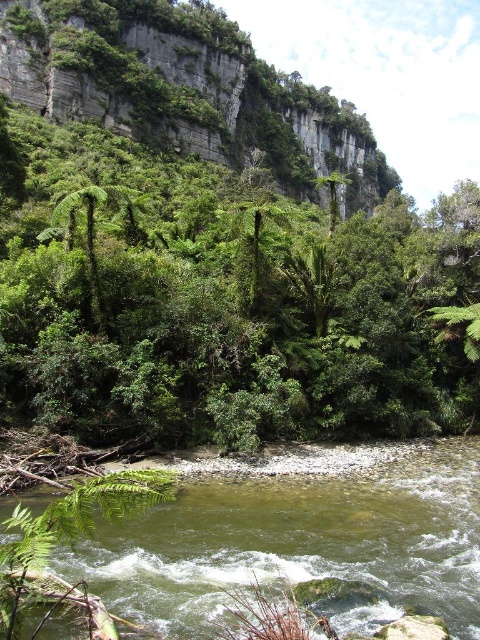
Question: Is green leafy tree at center thinner than green leafy hillside at upper left?

Choices:
 (A) yes
 (B) no

Answer: (A)

Question: Does green leafy tree at center have a greater width compared to green smooth water at center?

Choices:
 (A) no
 (B) yes

Answer: (B)

Question: Is green leafy tree at center thinner than green leafy hillside at upper left?

Choices:
 (A) no
 (B) yes

Answer: (B)

Question: Which of the following is the farthest from the observer?

Choices:
 (A) green leafy tree at center
 (B) green smooth water at center
 (C) green leafy hillside at upper left

Answer: (C)

Question: Which of the following is the closest to the observer?

Choices:
 (A) green leafy tree at center
 (B) green smooth water at center
 (C) green leafy hillside at upper left

Answer: (B)

Question: Which point is farther from the camera taking this photo?

Choices:
 (A) (153, 330)
 (B) (142, 609)
 (C) (141, 96)

Answer: (C)